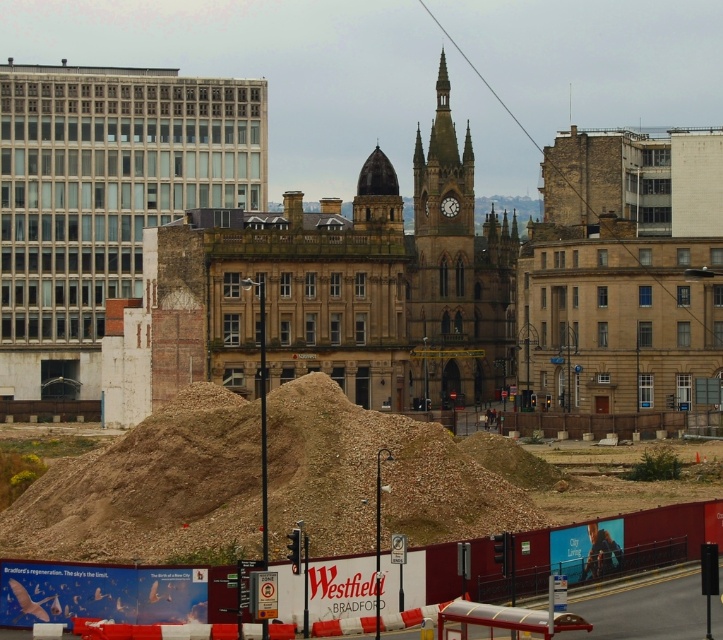
Question: Which object is positioned farthest from the brown gravel mound at center?

Choices:
 (A) smooth stone dome at center
 (B) matte glass building at left
 (C) brown stone clock tower at center

Answer: (B)

Question: Which of these objects is positioned farthest from the brown gravel mound at center?

Choices:
 (A) matte glass building at left
 (B) brown stone clock tower at center
 (C) smooth stone dome at center

Answer: (A)

Question: Which point appears closest to the camera in this image?

Choices:
 (A) (526, 522)
 (B) (351, 202)

Answer: (A)

Question: Can you confirm if brown gravel mound at center is smaller than smooth stone dome at center?

Choices:
 (A) no
 (B) yes

Answer: (A)

Question: Does matte glass building at left appear under brown stone clock tower at center?

Choices:
 (A) yes
 (B) no

Answer: (B)

Question: Does brown gravel mound at center appear on the left side of smooth stone dome at center?

Choices:
 (A) yes
 (B) no

Answer: (A)